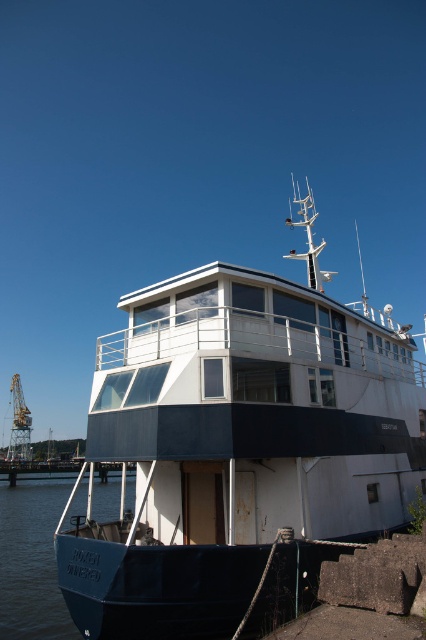
You are standing on the pier next to the houseboat. You notice a point marked at coordinates (238,449). What object is located at that point?

The white matte cabin cruiser at center is located at point (238,449).

You are a delivery drone that needs to deliver a package to the white matte cabin cruiser at center. There is a teal rubber boat at lower left nearby. Can you safely fly over the space between them without hitting any obstacles?

The distance between the white matte cabin cruiser at center and the teal rubber boat at lower left is 9.48 meters. Since there are no mentioned obstacles in the scene description, the drone can safely fly over the space between them.

You are standing on the pier and want to board the white matte cabin cruiser at center and the teal rubber boat at lower left. Which one can you reach without walking further away from your current position?

The white matte cabin cruiser at center is closer to the viewer than the teal rubber boat at lower left, so you can reach it without walking further away from your current position.